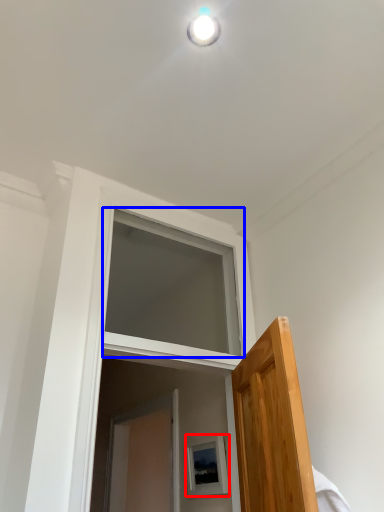
Question: Which object is closer to the camera taking this photo, picture frame (highlighted by a red box) or window (highlighted by a blue box)?

Choices:
 (A) picture frame
 (B) window

Answer: (B)